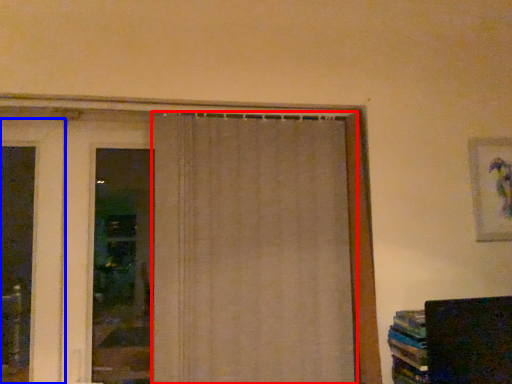
Question: Which point is closer to the camera, curtain (highlighted by a red box) or door (highlighted by a blue box)?

Choices:
 (A) curtain
 (B) door

Answer: (A)